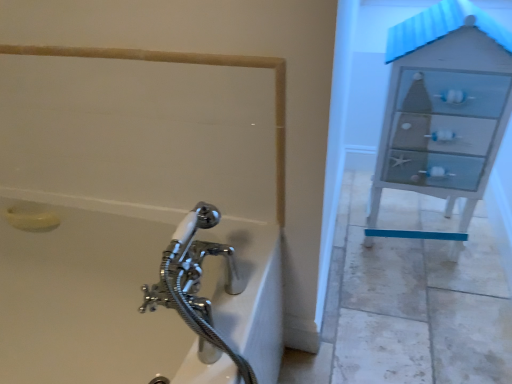
The width and height of the screenshot is (512, 384). In order to click on white glossy bathtub at lower left in this screenshot , I will do `click(91, 296)`.

This screenshot has width=512, height=384. Describe the element at coordinates (149, 56) in the screenshot. I see `beige matte rail at upper left` at that location.

Find the location of a particular element. Image resolution: width=512 pixels, height=384 pixels. white glossy file cabinet at right is located at coordinates (443, 111).

Based on the photo, is white glossy bathtub at lower left not close to yellow matte soap at lower left?

Actually, white glossy bathtub at lower left and yellow matte soap at lower left are a little close together.

From a real-world perspective, which is physically below, white glossy bathtub at lower left or yellow matte soap at lower left?

From a 3D spatial view, white glossy bathtub at lower left is below.

From the image's perspective, would you say white glossy bathtub at lower left is positioned over yellow matte soap at lower left?

Incorrect, from the image's perspective, white glossy bathtub at lower left is lower than yellow matte soap at lower left.

At what (x,y) coordinates should I click in order to perform the action: click on bathtub below the yellow matte soap at lower left (from a real-world perspective). Please return your answer as a coordinate pair (x, y). Looking at the image, I should click on (91, 296).

Relative to yellow matte soap at lower left, is white glossy file cabinet at right in front or behind?

In the image, white glossy file cabinet at right appears in front of yellow matte soap at lower left.

Consider the image. Is white glossy file cabinet at right far from yellow matte soap at lower left?

Indeed, white glossy file cabinet at right is not near yellow matte soap at lower left.

Considering the relative sizes of white glossy file cabinet at right and yellow matte soap at lower left in the image provided, is white glossy file cabinet at right shorter than yellow matte soap at lower left?

In fact, white glossy file cabinet at right may be taller than yellow matte soap at lower left.

Is yellow matte soap at lower left surrounded by white glossy file cabinet at right?

No, white glossy file cabinet at right does not contain yellow matte soap at lower left.

From a real-world perspective, which is physically below, white glossy bathtub at lower left or beige matte rail at upper left?

From a 3D spatial view, white glossy bathtub at lower left is below.

Relative to beige matte rail at upper left, is white glossy bathtub at lower left in front or behind?

Clearly, white glossy bathtub at lower left is in front of beige matte rail at upper left.

Which of these two, white glossy bathtub at lower left or beige matte rail at upper left, stands taller?

Standing taller between the two is white glossy bathtub at lower left.

Considering the sizes of objects white glossy bathtub at lower left and beige matte rail at upper left in the image provided, who is wider, white glossy bathtub at lower left or beige matte rail at upper left?

white glossy bathtub at lower left.

Is yellow matte soap at lower left facing towards white glossy file cabinet at right?

No, yellow matte soap at lower left is not facing towards white glossy file cabinet at right.

In the scene shown: Who is bigger, yellow matte soap at lower left or white glossy file cabinet at right?

With larger size is white glossy file cabinet at right.

Between point (15, 220) and point (404, 92), which one is positioned behind?

The point (404, 92) is farther.

Based on the photo, how different are the orientations of yellow matte soap at lower left and white glossy file cabinet at right in degrees?

The angular difference between yellow matte soap at lower left and white glossy file cabinet at right is 5.61 degrees.

Which is behind, beige matte rail at upper left or white glossy bathtub at lower left?

beige matte rail at upper left.

Locate an element on the screen. Image resolution: width=512 pixels, height=384 pixels. rail behind the white glossy bathtub at lower left is located at coordinates (149, 56).

From a real-world perspective, between beige matte rail at upper left and white glossy bathtub at lower left, who is vertically higher?

In real-world perspective, beige matte rail at upper left is above.

From the image's perspective, is beige matte rail at upper left below white glossy bathtub at lower left?

No.

The image size is (512, 384). Find the location of `bathtub on the left side of white glossy file cabinet at right`. bathtub on the left side of white glossy file cabinet at right is located at coordinates (91, 296).

Is the depth of white glossy bathtub at lower left less than that of white glossy file cabinet at right?

That is True.

How different are the orientations of white glossy bathtub at lower left and white glossy file cabinet at right in degrees?

The angular difference between white glossy bathtub at lower left and white glossy file cabinet at right is 4.46 degrees.

Is white glossy bathtub at lower left inside the boundaries of white glossy file cabinet at right, or outside?

white glossy bathtub at lower left is outside white glossy file cabinet at right.

Can you tell me how much yellow matte soap at lower left and white glossy bathtub at lower left differ in facing direction?

The angle between the facing direction of yellow matte soap at lower left and the facing direction of white glossy bathtub at lower left is 1.15 degrees.

From the image's perspective, relative to white glossy bathtub at lower left, is yellow matte soap at lower left above or below?

Clearly, from the image's perspective, yellow matte soap at lower left is above white glossy bathtub at lower left.

Is yellow matte soap at lower left in contact with white glossy bathtub at lower left?

No, yellow matte soap at lower left is not next to white glossy bathtub at lower left.

From a real-world perspective, which is physically below, yellow matte soap at lower left or white glossy bathtub at lower left?

white glossy bathtub at lower left.

The height and width of the screenshot is (384, 512). I want to click on bathtub located on the right of yellow matte soap at lower left, so coord(91,296).

Image resolution: width=512 pixels, height=384 pixels. Identify the location of file cabinet in front of the yellow matte soap at lower left. (443, 111).

From the image, which object appears to be nearer to white glossy bathtub at lower left, white glossy file cabinet at right or yellow matte soap at lower left?

yellow matte soap at lower left.

When comparing their distances from white glossy bathtub at lower left, does beige matte rail at upper left or yellow matte soap at lower left seem further?

Answer: beige matte rail at upper left is further to white glossy bathtub at lower left.

Looking at the image, which one is located closer to white glossy bathtub at lower left, yellow matte soap at lower left or white glossy file cabinet at right?

yellow matte soap at lower left is closer to white glossy bathtub at lower left.

Based on the photo, when comparing their distances from beige matte rail at upper left, does yellow matte soap at lower left or white glossy bathtub at lower left seem closer?

Based on the image, yellow matte soap at lower left appears to be nearer to beige matte rail at upper left.

Looking at this image, considering their positions, is beige matte rail at upper left positioned closer to white glossy file cabinet at right than yellow matte soap at lower left?

beige matte rail at upper left is closer to white glossy file cabinet at right.

Which object lies further to the anchor point yellow matte soap at lower left, white glossy file cabinet at right or white glossy bathtub at lower left?

white glossy file cabinet at right lies further to yellow matte soap at lower left than the other object.

When comparing their distances from beige matte rail at upper left, does yellow matte soap at lower left or white glossy file cabinet at right seem further?

white glossy file cabinet at right lies further to beige matte rail at upper left than the other object.

When comparing their distances from white glossy file cabinet at right, does yellow matte soap at lower left or beige matte rail at upper left seem closer?

Based on the image, beige matte rail at upper left appears to be nearer to white glossy file cabinet at right.

This screenshot has width=512, height=384. Find the location of `bathtub between yellow matte soap at lower left and white glossy file cabinet at right in the horizontal direction`. bathtub between yellow matte soap at lower left and white glossy file cabinet at right in the horizontal direction is located at coordinates (91, 296).

Find the location of `rail between yellow matte soap at lower left and white glossy file cabinet at right from left to right`. rail between yellow matte soap at lower left and white glossy file cabinet at right from left to right is located at coordinates (149, 56).

At what (x,y) coordinates should I click in order to perform the action: click on soap between beige matte rail at upper left and white glossy bathtub at lower left in the up-down direction. Please return your answer as a coordinate pair (x, y). The width and height of the screenshot is (512, 384). Looking at the image, I should click on (31, 220).

This screenshot has height=384, width=512. I want to click on rail located between white glossy bathtub at lower left and white glossy file cabinet at right in the left-right direction, so click(x=149, y=56).